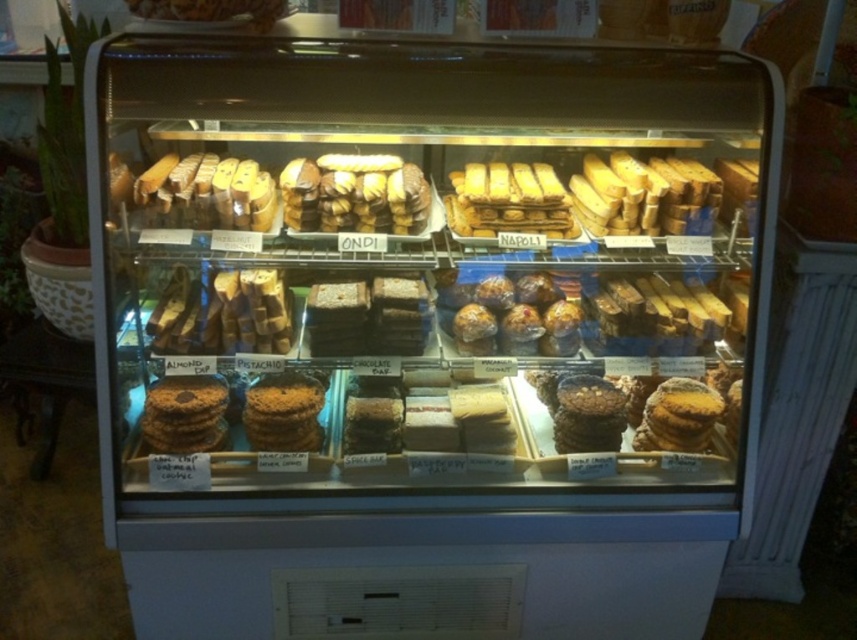
Question: Among these points, which one is nearest to the camera?

Choices:
 (A) (544, 321)
 (B) (681, 435)
 (C) (427, 211)

Answer: (B)

Question: Which point is farther to the camera?

Choices:
 (A) brown matte cookies at center
 (B) brown crumbly pastry at center
 (C) brown crumbly cookie at center
 (D) chocolate cookie at center

Answer: (B)

Question: Can you confirm if brown crumbly cookie at lower left is positioned to the left of chocolate cookie at center?

Choices:
 (A) no
 (B) yes

Answer: (B)

Question: Which of the following is the farthest from the observer?

Choices:
 (A) (406, 172)
 (B) (306, 380)
 (C) (148, 394)

Answer: (A)

Question: Is brown crumbly cookie at center thinner than chocolate cookie at center?

Choices:
 (A) no
 (B) yes

Answer: (B)

Question: Does brown crumbly pastry at center appear on the left side of brown crumbly cookie at lower left?

Choices:
 (A) yes
 (B) no

Answer: (B)